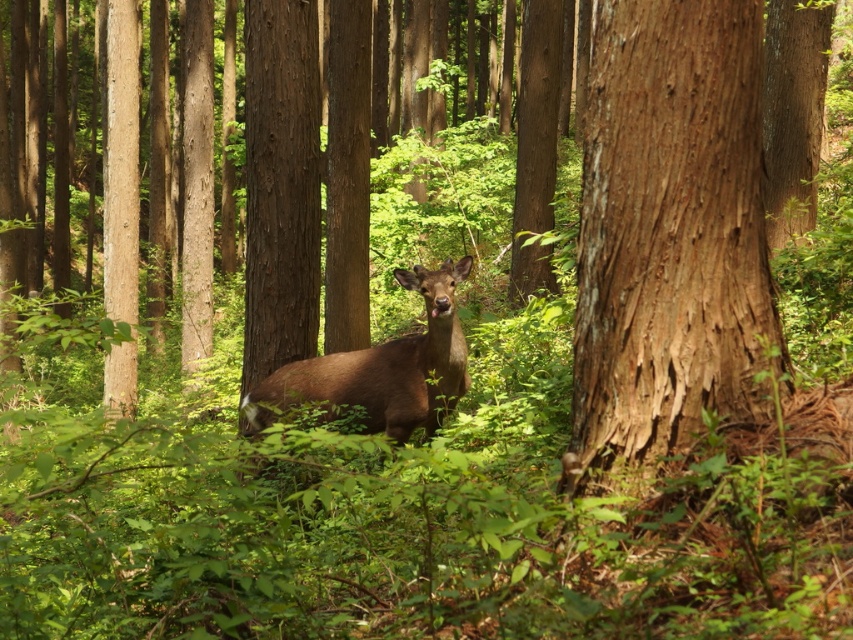
You are navigating through the forest and want to reach a specific location marked by point (686,262). There is another point (421,289) in the scene. Which point is closer to your current position?

Point (686,262) is closer to the camera than point (421,289), so the point (686,262) is closer to your current position.